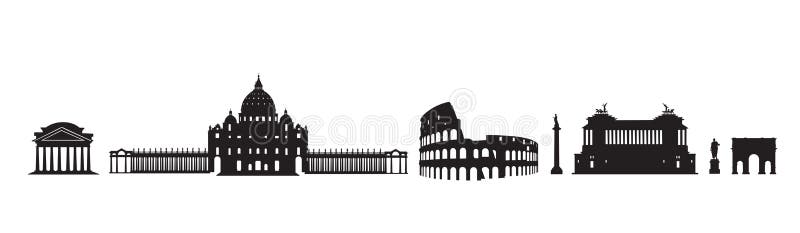
Locate an element on the screen. triple arched doorway is located at coordinates (752, 144).